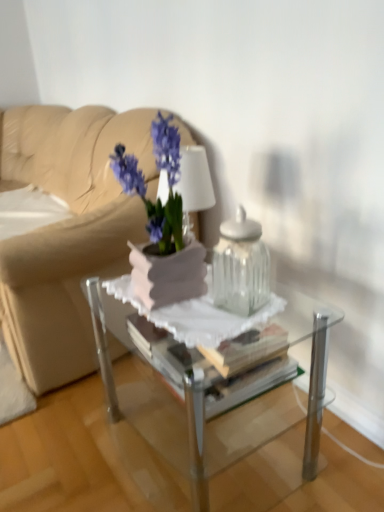
Measure the distance between point (62, 258) and camera.

4.30 feet.

At what (x,y) coordinates should I click in order to perform the action: click on clear glass jar at center. Please return your answer as a coordinate pair (x, y). This screenshot has height=512, width=384. Looking at the image, I should click on (241, 266).

Describe the element at coordinates (241, 266) in the screenshot. The height and width of the screenshot is (512, 384). I see `clear glass jar at center` at that location.

Identify the location of clear glass table at center. (181, 406).

Can you confirm if clear glass jar at center is smaller than beige leather couch at upper left?

Yes.

Which is more to the right, clear glass jar at center or beige leather couch at upper left?

clear glass jar at center.

Is beige leather couch at upper left inside clear glass jar at center?

No, beige leather couch at upper left is not surrounded by clear glass jar at center.

How many degrees apart are the facing directions of clear glass jar at center and beige leather couch at upper left?

clear glass jar at center and beige leather couch at upper left are facing 13.8 degrees away from each other.

Is clear glass table at center smaller than clear glass jar at center?

Incorrect, clear glass table at center is not smaller in size than clear glass jar at center.

From the image's perspective, does clear glass table at center appear lower than clear glass jar at center?

Yes.

Locate an element on the screen. This screenshot has height=512, width=384. vase that appears above the clear glass table at center (from the image's perspective) is located at coordinates (241, 266).

Is clear glass table at center not close to clear glass jar at center?

clear glass table at center is near clear glass jar at center, not far away.

From the image's perspective, who appears lower, matte white vase at center or clear glass table at center?

clear glass table at center appears lower in the image.

From a real-world perspective, which is physically below, matte white vase at center or clear glass table at center?

clear glass table at center, from a real-world perspective.

Does matte white vase at center have a smaller size compared to clear glass table at center?

Correct, matte white vase at center occupies less space than clear glass table at center.

Is clear glass jar at center a part of beige leather couch at upper left?

No, clear glass jar at center is not surrounded by beige leather couch at upper left.

Is beige leather couch at upper left far from clear glass jar at center?

No, there isn't a large distance between beige leather couch at upper left and clear glass jar at center.

Is beige leather couch at upper left aimed at clear glass jar at center?

No, beige leather couch at upper left is not facing towards clear glass jar at center.

Considering their positions, is beige leather couch at upper left located in front of or behind clear glass jar at center?

Clearly, beige leather couch at upper left is behind clear glass jar at center.

Is clear glass jar at center turned away from matte white vase at center?

No, clear glass jar at center is not facing away from matte white vase at center.

Would you say matte white vase at center is part of clear glass jar at center's contents?

No, matte white vase at center is not surrounded by clear glass jar at center.

Considering the points (237, 269) and (173, 194), which point is behind, point (237, 269) or point (173, 194)?

Positioned behind is point (237, 269).

How many degrees apart are the facing directions of clear glass jar at center and matte white vase at center?

19.5 degrees.

Which of these two, clear glass jar at center or clear glass table at center, stands taller?

clear glass table at center is taller.

Could you tell me if clear glass jar at center is turned towards clear glass table at center?

No, clear glass jar at center is not facing towards clear glass table at center.

Considering the points (260, 231) and (119, 417), which point is behind, point (260, 231) or point (119, 417)?

Point (260, 231)

From a real-world perspective, who is located higher, clear glass jar at center or clear glass table at center?

From a 3D spatial view, clear glass jar at center is above.

Is beige leather couch at upper left to the left or to the right of matte white vase at center in the image?

beige leather couch at upper left is to the left of matte white vase at center.

Can you see beige leather couch at upper left touching matte white vase at center?

No, beige leather couch at upper left is not beside matte white vase at center.

Does point (77, 117) appear closer or farther from the camera than point (157, 124)?

Point (77, 117) is positioned farther from the camera compared to point (157, 124).

Between beige leather couch at upper left and matte white vase at center, which one has larger size?

Bigger between the two is beige leather couch at upper left.

Find the location of a particular element. vase that is on the right side of beige leather couch at upper left is located at coordinates (241, 266).

At what (x,y) coordinates should I click in order to perform the action: click on table below the clear glass jar at center (from a real-world perspective). Please return your answer as a coordinate pair (x, y). This screenshot has height=512, width=384. Looking at the image, I should click on pos(181,406).

Considering their positions, is clear glass jar at center positioned closer to clear glass table at center than matte white vase at center?

clear glass jar at center is positioned closer to the anchor clear glass table at center.

Consider the image. Which object lies nearer to the anchor point clear glass table at center, beige leather couch at upper left or matte white vase at center?

matte white vase at center lies closer to clear glass table at center than the other object.

Looking at the image, which one is located closer to beige leather couch at upper left, clear glass jar at center or clear glass table at center?

Among the two, clear glass table at center is located nearer to beige leather couch at upper left.

Which object lies nearer to the anchor point matte white vase at center, clear glass table at center or beige leather couch at upper left?

clear glass table at center is closer to matte white vase at center.

Which object lies nearer to the anchor point clear glass table at center, clear glass jar at center or beige leather couch at upper left?

clear glass jar at center is positioned closer to the anchor clear glass table at center.

Which object lies further to the anchor point matte white vase at center, clear glass jar at center or beige leather couch at upper left?

beige leather couch at upper left is positioned further to the anchor matte white vase at center.

When comparing their distances from beige leather couch at upper left, does clear glass table at center or matte white vase at center seem closer?

matte white vase at center.

Based on their spatial positions, is beige leather couch at upper left or matte white vase at center further from clear glass jar at center?

→ beige leather couch at upper left lies further to clear glass jar at center than the other object.

Identify the location of table located between beige leather couch at upper left and clear glass jar at center in the left-right direction. The width and height of the screenshot is (384, 512). (181, 406).

Where is `houseplant situated between beige leather couch at upper left and clear glass table at center from left to right`? houseplant situated between beige leather couch at upper left and clear glass table at center from left to right is located at coordinates (162, 225).

Locate an element on the screen. The width and height of the screenshot is (384, 512). houseplant between beige leather couch at upper left and clear glass jar at center is located at coordinates (162, 225).

The image size is (384, 512). In order to click on vase between matte white vase at center and clear glass table at center from top to bottom in this screenshot , I will do `click(241, 266)`.